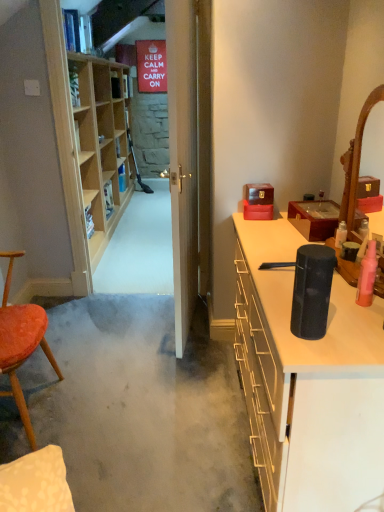
This screenshot has width=384, height=512. Identify the location of unoccupied space behind black matte speaker at right. (288, 303).